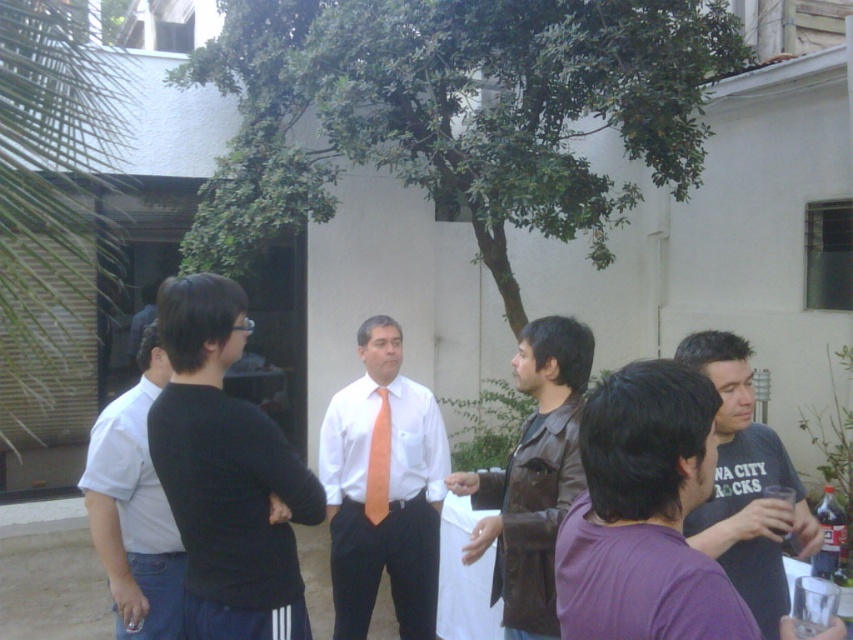
Question: Estimate the real-world distances between objects in this image. Which object is farther from the black cotton shirt at left?

Choices:
 (A) matte orange tie at center
 (B) orange satin tie at center
 (C) brown leather jacket at center
 (D) black matte shirt at left

Answer: (C)

Question: Based on their relative distances, which object is farther from the dark gray t-shirt at right?

Choices:
 (A) black matte shirt at left
 (B) matte orange tie at center
 (C) black cotton shirt at left
 (D) brown leather jacket at center

Answer: (C)

Question: Does matte orange tie at center appear under orange satin tie at center?

Choices:
 (A) no
 (B) yes

Answer: (B)

Question: Considering the real-world distances, which object is farthest from the matte orange tie at center?

Choices:
 (A) brown leather jacket at center
 (B) black matte shirt at left
 (C) black cotton shirt at left

Answer: (B)

Question: In this image, where is matte orange tie at center located relative to orange satin tie at center?

Choices:
 (A) left
 (B) right

Answer: (B)

Question: Can you confirm if matte orange tie at center is positioned above brown leather jacket at center?

Choices:
 (A) yes
 (B) no

Answer: (B)